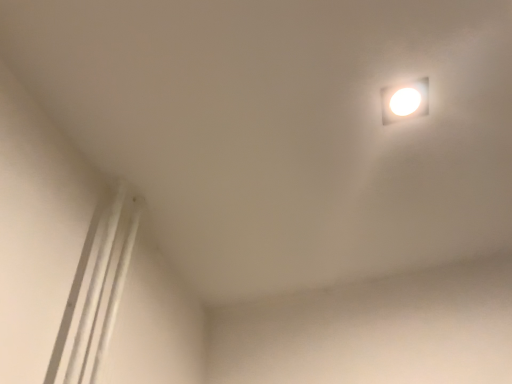
Identify the location of white glossy light fixture at upper right. The width and height of the screenshot is (512, 384). (405, 101).

This screenshot has height=384, width=512. Describe the element at coordinates (405, 101) in the screenshot. I see `white glossy light fixture at upper right` at that location.

The image size is (512, 384). I want to click on white glossy light fixture at upper right, so click(x=405, y=101).